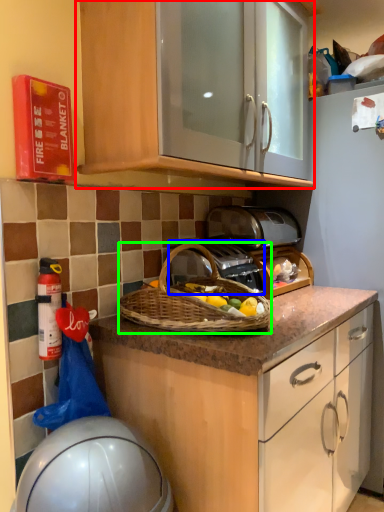
Question: Which is farther away from cabinetry (highlighted by a red box)? gas stove (highlighted by a blue box) or picnic basket (highlighted by a green box)?

Choices:
 (A) gas stove
 (B) picnic basket

Answer: (A)